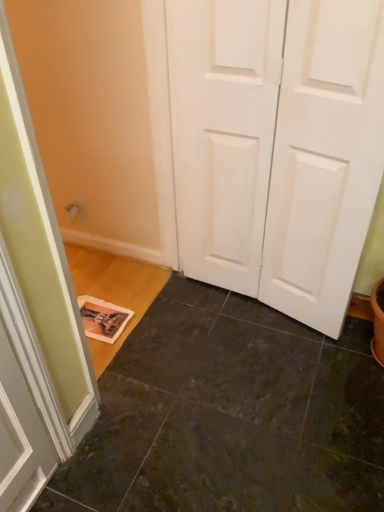
Question: Can you confirm if dark slate tile at lower center is bigger than white matte door at center?

Choices:
 (A) no
 (B) yes

Answer: (A)

Question: Considering the relative sizes of dark slate tile at lower center and white matte door at center in the image provided, is dark slate tile at lower center smaller than white matte door at center?

Choices:
 (A) no
 (B) yes

Answer: (B)

Question: Are dark slate tile at lower center and white matte door at center beside each other?

Choices:
 (A) yes
 (B) no

Answer: (B)

Question: Is dark slate tile at lower center thinner than white matte door at center?

Choices:
 (A) yes
 (B) no

Answer: (B)

Question: Can we say dark slate tile at lower center lies outside white matte door at center?

Choices:
 (A) yes
 (B) no

Answer: (A)

Question: From the image's perspective, is dark slate tile at lower center on white matte door at center?

Choices:
 (A) no
 (B) yes

Answer: (A)

Question: From the image's perspective, is white matte door at center located above dark slate tile at lower center?

Choices:
 (A) no
 (B) yes

Answer: (B)

Question: Does white matte door at center turn towards dark slate tile at lower center?

Choices:
 (A) yes
 (B) no

Answer: (A)

Question: From a real-world perspective, is white matte door at center over dark slate tile at lower center?

Choices:
 (A) no
 (B) yes

Answer: (B)

Question: Is white matte door at center wider than dark slate tile at lower center?

Choices:
 (A) yes
 (B) no

Answer: (B)

Question: Can you confirm if white matte door at center is positioned to the right of dark slate tile at lower center?

Choices:
 (A) no
 (B) yes

Answer: (B)

Question: Is white matte door at center beside dark slate tile at lower center?

Choices:
 (A) yes
 (B) no

Answer: (B)

Question: Is white matte door at center spatially inside dark slate tile at lower center, or outside of it?

Choices:
 (A) outside
 (B) inside

Answer: (A)